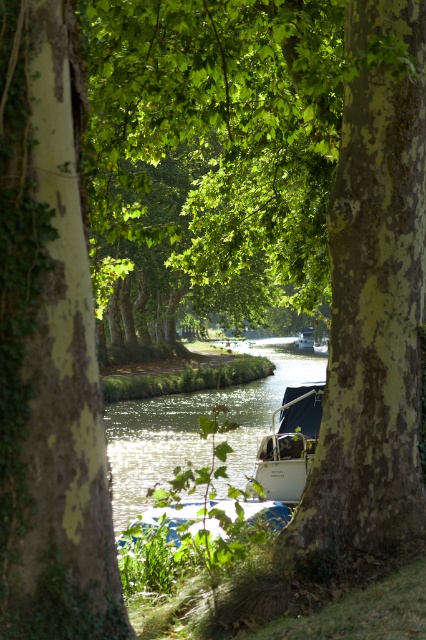
Question: Which point is farther from the camera taking this photo?

Choices:
 (A) coord(244,417)
 (B) coord(275,440)
 (C) coord(305,333)
 (D) coord(25,209)

Answer: (C)

Question: Can you confirm if green smooth water at center is positioned to the left of white matte boat at center?

Choices:
 (A) yes
 (B) no

Answer: (A)

Question: Is white matte boat at center below white glossy boat at center?

Choices:
 (A) yes
 (B) no

Answer: (A)

Question: Is green textured bark tree at center closer to the viewer compared to green smooth water at center?

Choices:
 (A) yes
 (B) no

Answer: (A)

Question: Among these points, which one is nearest to the camera?

Choices:
 (A) (97, 513)
 (B) (305, 339)
 (C) (143, 461)

Answer: (A)

Question: Among these points, which one is nearest to the camera?

Choices:
 (A) (221, 492)
 (B) (308, 342)
 (C) (293, 461)

Answer: (C)